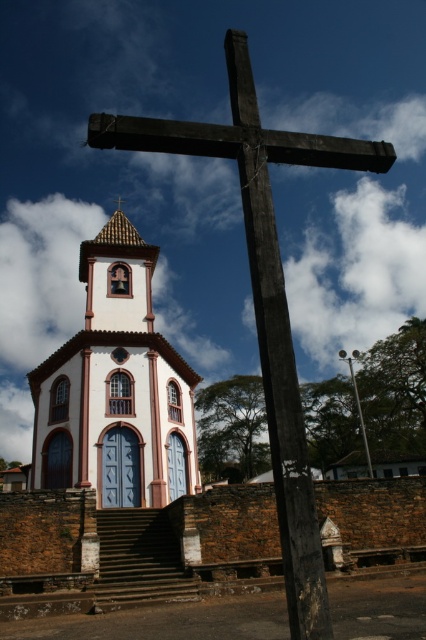
You are standing at the point marked as point (115, 387) in the image. What object is located exactly at that point?

The white matte church at center is located exactly at point (115, 387).